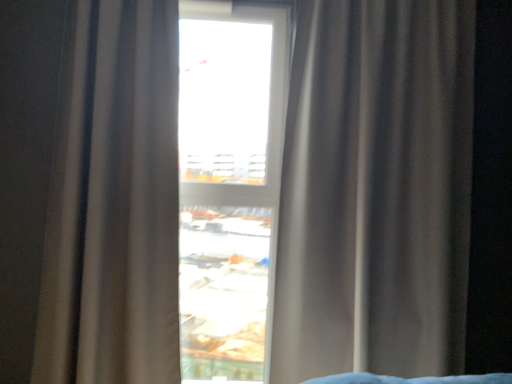
Question: From a real-world perspective, is satin beige curtain at center, which is the 1th curtain from right to left, physically above satin beige curtain at center, which appears as the 1th curtain when viewed from the left?

Choices:
 (A) yes
 (B) no

Answer: (A)

Question: Does satin beige curtain at center, which is the 1th curtain from right to left, appear on the right side of satin beige curtain at center, which appears as the 1th curtain when viewed from the left?

Choices:
 (A) yes
 (B) no

Answer: (A)

Question: Is satin beige curtain at center, arranged as the 2th curtain when viewed from the left, to the left of satin beige curtain at center, which appears as the 1th curtain when viewed from the left, from the viewer's perspective?

Choices:
 (A) yes
 (B) no

Answer: (B)

Question: Is satin beige curtain at center, arranged as the 2th curtain when viewed from the left, aimed at satin beige curtain at center, the second curtain viewed from the right?

Choices:
 (A) yes
 (B) no

Answer: (B)

Question: Is satin beige curtain at center, which is the 1th curtain from right to left, not inside satin beige curtain at center, which appears as the 1th curtain when viewed from the left?

Choices:
 (A) yes
 (B) no

Answer: (A)

Question: Looking at their shapes, would you say satin beige curtain at center, which is the 1th curtain from right to left, is wider or thinner than transparent glass window at center?

Choices:
 (A) wide
 (B) thin

Answer: (A)

Question: Is satin beige curtain at center, which is the 1th curtain from right to left, to the left or to the right of transparent glass window at center in the image?

Choices:
 (A) left
 (B) right

Answer: (B)

Question: Does point (364, 150) appear closer or farther from the camera than point (201, 218)?

Choices:
 (A) closer
 (B) farther

Answer: (A)

Question: In the image, is satin beige curtain at center, arranged as the 2th curtain when viewed from the left, positioned in front of or behind transparent glass window at center?

Choices:
 (A) front
 (B) behind

Answer: (A)

Question: From a real-world perspective, is transparent glass window at center above or below satin beige curtain at center, which appears as the 1th curtain when viewed from the left?

Choices:
 (A) below
 (B) above

Answer: (B)

Question: Considering the positions of transparent glass window at center and satin beige curtain at center, which appears as the 1th curtain when viewed from the left, in the image, is transparent glass window at center bigger or smaller than satin beige curtain at center, which appears as the 1th curtain when viewed from the left,?

Choices:
 (A) small
 (B) big

Answer: (A)

Question: Considering the positions of transparent glass window at center and satin beige curtain at center, which appears as the 1th curtain when viewed from the left, in the image, is transparent glass window at center taller or shorter than satin beige curtain at center, which appears as the 1th curtain when viewed from the left,?

Choices:
 (A) tall
 (B) short

Answer: (A)

Question: Relative to satin beige curtain at center, the second curtain viewed from the right, is transparent glass window at center in front or behind?

Choices:
 (A) behind
 (B) front

Answer: (A)

Question: In the image, is satin beige curtain at center, which appears as the 1th curtain when viewed from the left, positioned in front of or behind satin beige curtain at center, which is the 1th curtain from right to left?

Choices:
 (A) front
 (B) behind

Answer: (A)

Question: From the image's perspective, is satin beige curtain at center, the second curtain viewed from the right, located above or below satin beige curtain at center, which is the 1th curtain from right to left?

Choices:
 (A) above
 (B) below

Answer: (A)